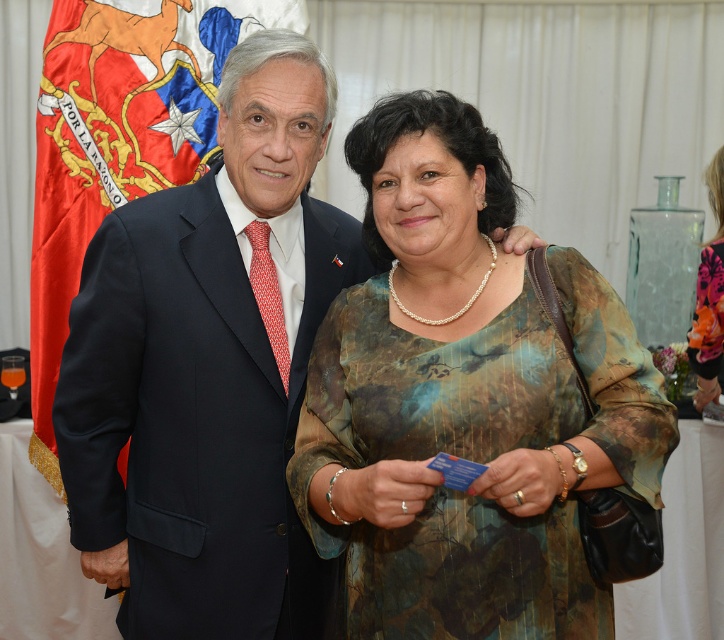
Which is more to the right, textured green dress at center or red silk flag at left?

textured green dress at center

Between textured green dress at center and red silk flag at left, which one is positioned lower?

textured green dress at center is below.

Which is in front, point (313, 474) or point (37, 376)?

Point (313, 474) is more forward.

The width and height of the screenshot is (724, 640). Find the location of `textured green dress at center`. textured green dress at center is located at coordinates (466, 401).

Is point (264, 26) positioned before point (719, 307)?

That is True.

Image resolution: width=724 pixels, height=640 pixels. I want to click on red silk flag at left, so click(119, 140).

Between point (146, 28) and point (707, 248), which one is positioned in front?

Point (146, 28) is more forward.

Where is `red silk flag at left`? This screenshot has height=640, width=724. red silk flag at left is located at coordinates (119, 140).

Does dark blue suit at center lie in front of red silk flag at left?

Yes.

Does dark blue suit at center appear on the right side of red silk flag at left?

Indeed, dark blue suit at center is positioned on the right side of red silk flag at left.

Who is more distant from viewer, (130, 356) or (80, 260)?

Positioned behind is point (80, 260).

Where is `dark blue suit at center`? The height and width of the screenshot is (640, 724). dark blue suit at center is located at coordinates (195, 419).